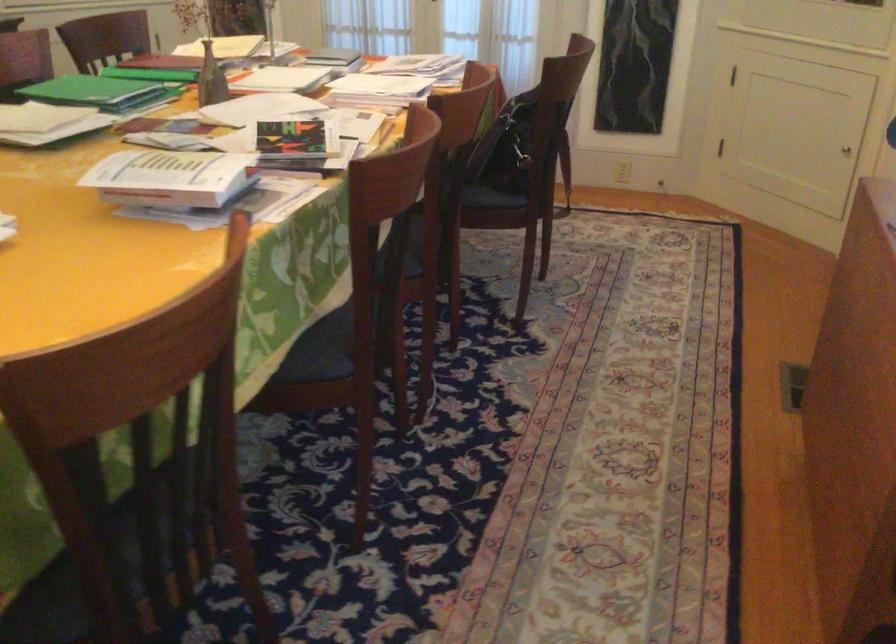
Where would you pull the cabinet door handle? Please return your answer as a coordinate pair (x, y).

(846, 149)